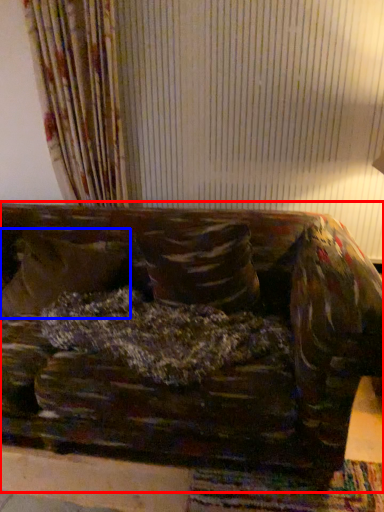
Question: Among these objects, which one is nearest to the camera, studio couch (highlighted by a red box) or pillow (highlighted by a blue box)?

Choices:
 (A) studio couch
 (B) pillow

Answer: (A)